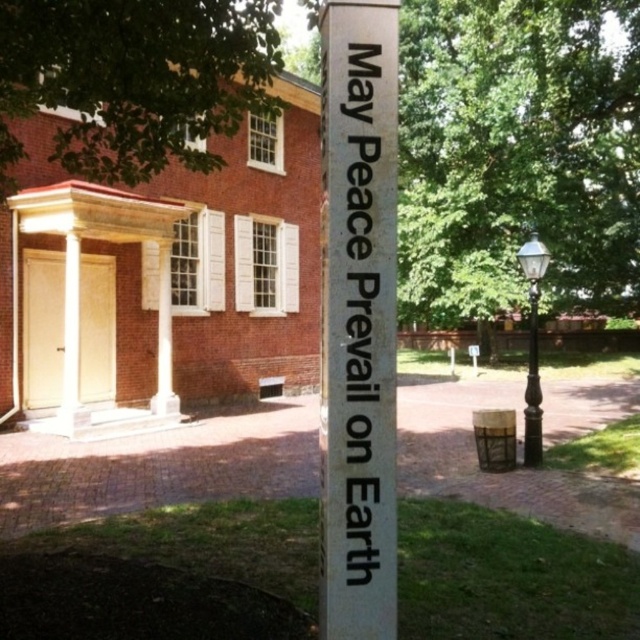
Question: Which object appears farthest from the camera in this image?

Choices:
 (A) green leafy tree at upper left
 (B) white plastic sign at center

Answer: (B)

Question: Among these objects, which one is farthest from the camera?

Choices:
 (A) green leafy tree at upper left
 (B) black polished metal lamp post at right
 (C) white paper sign at center

Answer: (B)

Question: Can you confirm if white glossy sign at center is wider than white plastic sign at center?

Choices:
 (A) yes
 (B) no

Answer: (B)

Question: Can you confirm if green leafy tree at upper left is positioned above white plastic sign at center?

Choices:
 (A) yes
 (B) no

Answer: (A)

Question: Among these objects, which one is farthest from the camera?

Choices:
 (A) white plastic sign at center
 (B) white paper sign at center
 (C) white glossy sign at center

Answer: (A)

Question: Where is green leafy tree at upper left located in relation to white paper sign at center in the image?

Choices:
 (A) right
 (B) left

Answer: (B)